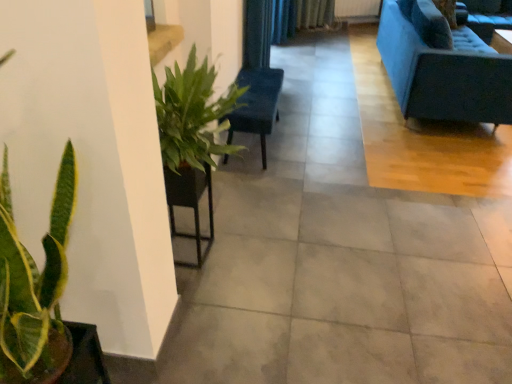
This screenshot has width=512, height=384. Describe the element at coordinates (256, 104) in the screenshot. I see `velvet dark blue armchair at center` at that location.

I want to click on velvet blue couch at upper right, so click(x=442, y=66).

Which is more to the left, black fabric curtain at upper center or velvet blue couch at upper right?

black fabric curtain at upper center is more to the left.

Based on the photo, is velvet blue couch at upper right surrounded by black fabric curtain at upper center?

No.

Is black fabric curtain at upper center positioned behind velvet blue couch at upper right?

Yes, black fabric curtain at upper center is further from the camera.

From the image's perspective, is black fabric curtain at upper center located above or below velvet blue couch at upper right?

Based on their image positions, black fabric curtain at upper center is located beneath velvet blue couch at upper right.

Looking at the image, does velvet blue couch at upper right seem bigger or smaller compared to matte brown flowerpot at lower left?

Considering their sizes, velvet blue couch at upper right takes up more space than matte brown flowerpot at lower left.

Considering the relative sizes of velvet blue couch at upper right and matte brown flowerpot at lower left in the image provided, is velvet blue couch at upper right taller than matte brown flowerpot at lower left?

Yes, velvet blue couch at upper right is taller than matte brown flowerpot at lower left.

In the scene shown: Considering the relative positions of velvet blue couch at upper right and matte brown flowerpot at lower left in the image provided, is velvet blue couch at upper right to the left of matte brown flowerpot at lower left from the viewer's perspective?

Incorrect, velvet blue couch at upper right is not on the left side of matte brown flowerpot at lower left.

Based on the photo, is black fabric curtain at upper center not near velvet dark blue armchair at center?

They are positioned close to each other.

Is black fabric curtain at upper center completely or partially outside of velvet dark blue armchair at center?

black fabric curtain at upper center lies outside velvet dark blue armchair at center's area.

Is black fabric curtain at upper center oriented towards velvet dark blue armchair at center?

No.

The image size is (512, 384). What are the coordinates of `armchair directly beneath the black fabric curtain at upper center (from a real-world perspective)` in the screenshot? It's located at (256, 104).

Could you tell me if matte brown flowerpot at lower left is facing black fabric curtain at upper center?

No, matte brown flowerpot at lower left does not turn towards black fabric curtain at upper center.

Consider the image. From a real-world perspective, is matte brown flowerpot at lower left positioned under black fabric curtain at upper center based on gravity?

No.

From the image's perspective, is matte brown flowerpot at lower left located above or below black fabric curtain at upper center?

Clearly, from the image's perspective, matte brown flowerpot at lower left is below black fabric curtain at upper center.

Is matte brown flowerpot at lower left positioned beyond the bounds of black fabric curtain at upper center?

matte brown flowerpot at lower left is positioned outside black fabric curtain at upper center.

Is the position of velvet dark blue armchair at center more distant than that of velvet blue couch at upper right?

No, velvet dark blue armchair at center is closer to the camera.

Is velvet dark blue armchair at center taller or shorter than velvet blue couch at upper right?

Considering their sizes, velvet dark blue armchair at center has less height than velvet blue couch at upper right.

From the image's perspective, who appears lower, velvet dark blue armchair at center or velvet blue couch at upper right?

velvet dark blue armchair at center is shown below in the image.

From a real-world perspective, is velvet dark blue armchair at center located beneath velvet blue couch at upper right?

Yes, from a real-world perspective, velvet dark blue armchair at center is beneath velvet blue couch at upper right.

In the scene shown: Considering the sizes of objects matte brown flowerpot at lower left and green glossy plant at lower left in the image provided, who is bigger, matte brown flowerpot at lower left or green glossy plant at lower left?

green glossy plant at lower left.

Is the position of matte brown flowerpot at lower left less distant than that of green glossy plant at lower left?

That is False.

Image resolution: width=512 pixels, height=384 pixels. What are the coordinates of `flowerpot directly beneath the green glossy plant at lower left (from a real-world perspective)` in the screenshot? It's located at (85, 357).

Between matte brown flowerpot at lower left and green glossy plant at lower left, which one has less height?

matte brown flowerpot at lower left is shorter.

Does point (251, 122) lie in front of point (88, 339)?

No, (251, 122) is behind (88, 339).

Considering the sizes of objects velvet dark blue armchair at center and matte brown flowerpot at lower left in the image provided, who is smaller, velvet dark blue armchair at center or matte brown flowerpot at lower left?

With smaller size is matte brown flowerpot at lower left.

From a real-world perspective, between velvet dark blue armchair at center and matte brown flowerpot at lower left, who is vertically higher?

matte brown flowerpot at lower left, from a real-world perspective.

Is velvet dark blue armchair at center oriented towards matte brown flowerpot at lower left?

No, velvet dark blue armchair at center is not oriented towards matte brown flowerpot at lower left.

Where is `studio couch lying on the right of black fabric curtain at upper center`? studio couch lying on the right of black fabric curtain at upper center is located at coordinates (442, 66).

Where is `studio couch located above the matte brown flowerpot at lower left (from the image's perspective)`? This screenshot has width=512, height=384. studio couch located above the matte brown flowerpot at lower left (from the image's perspective) is located at coordinates (442, 66).

From the image, which object appears to be farther from green glossy plant at lower left, matte brown flowerpot at lower left or velvet blue couch at upper right?

The object further to green glossy plant at lower left is velvet blue couch at upper right.

When comparing their distances from velvet blue couch at upper right, does velvet dark blue armchair at center or black fabric curtain at upper center seem further?

Among the two, black fabric curtain at upper center is located further to velvet blue couch at upper right.

When comparing their distances from velvet dark blue armchair at center, does green glossy plant at lower left or matte brown flowerpot at lower left seem closer?

The object closer to velvet dark blue armchair at center is matte brown flowerpot at lower left.

From the image, which object appears to be farther from velvet dark blue armchair at center, velvet blue couch at upper right or black fabric curtain at upper center?

velvet blue couch at upper right.

Which object lies further to the anchor point black fabric curtain at upper center, green glossy plant at lower left or velvet blue couch at upper right?

Based on the image, green glossy plant at lower left appears to be further to black fabric curtain at upper center.

Based on their spatial positions, is velvet dark blue armchair at center or black fabric curtain at upper center closer to green glossy plant at lower left?

The object closer to green glossy plant at lower left is velvet dark blue armchair at center.

Based on their spatial positions, is black fabric curtain at upper center or matte brown flowerpot at lower left further from velvet dark blue armchair at center?

Among the two, matte brown flowerpot at lower left is located further to velvet dark blue armchair at center.

Which object lies nearer to the anchor point black fabric curtain at upper center, velvet blue couch at upper right or velvet dark blue armchair at center?

Based on the image, velvet dark blue armchair at center appears to be nearer to black fabric curtain at upper center.

Locate an element on the screen. armchair between green glossy plant at lower left and black fabric curtain at upper center along the z-axis is located at coordinates (256, 104).

The image size is (512, 384). Find the location of `studio couch located between green glossy plant at lower left and black fabric curtain at upper center in the depth direction`. studio couch located between green glossy plant at lower left and black fabric curtain at upper center in the depth direction is located at coordinates (442, 66).

Locate an element on the screen. flowerpot between green glossy plant at lower left and black fabric curtain at upper center in the front-back direction is located at coordinates (85, 357).

The width and height of the screenshot is (512, 384). I want to click on studio couch positioned between matte brown flowerpot at lower left and black fabric curtain at upper center from near to far, so click(442, 66).